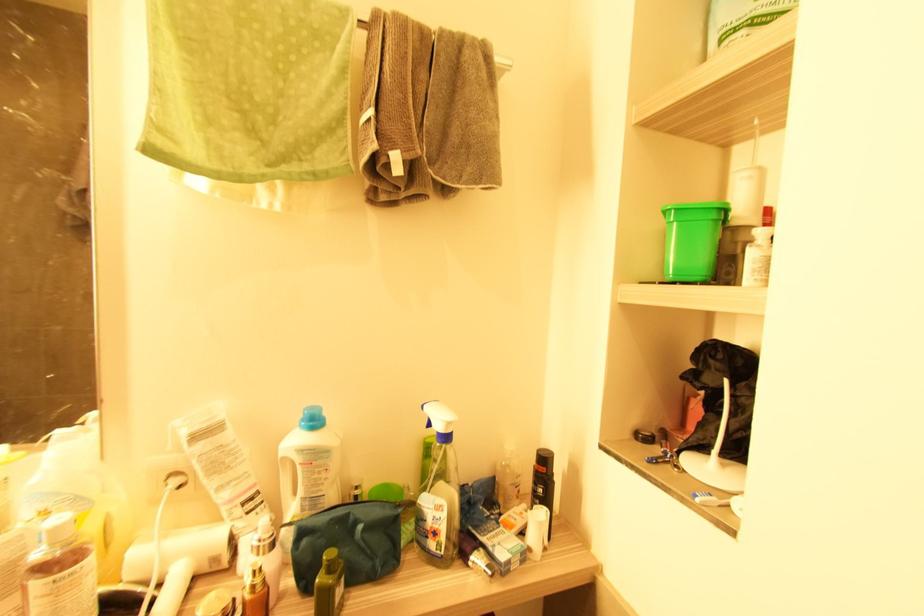
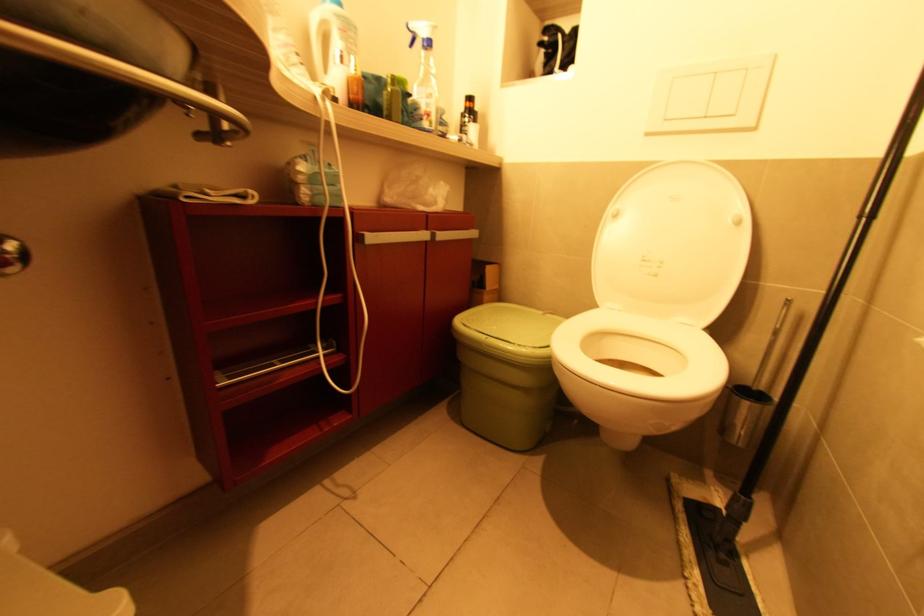
First-person continuous shooting, in which direction is the camera rotating?

The camera's rotation is toward right-down.